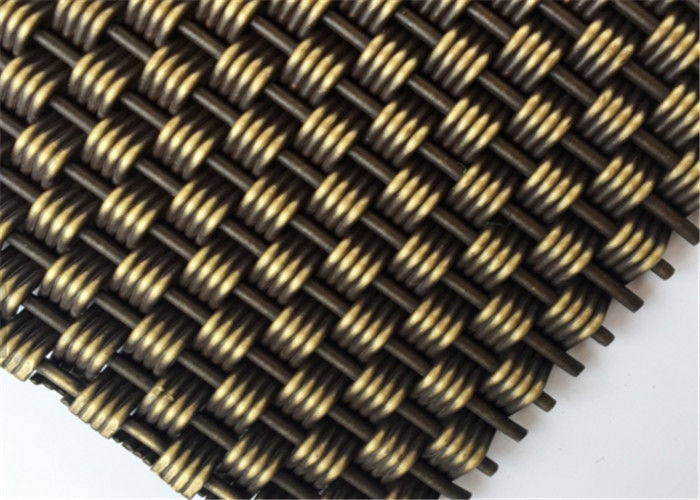
Find the location of a particular element. The height and width of the screenshot is (500, 700). right corner is located at coordinates (693, 233).